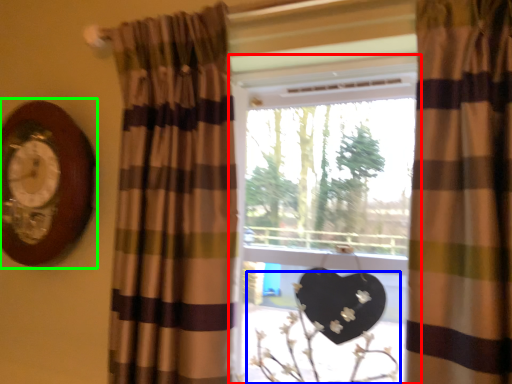
Question: Which object is positioned closest to window (highlighted by a red box)? Select from floral arrangement (highlighted by a blue box) and clock (highlighted by a green box).

Choices:
 (A) floral arrangement
 (B) clock

Answer: (A)